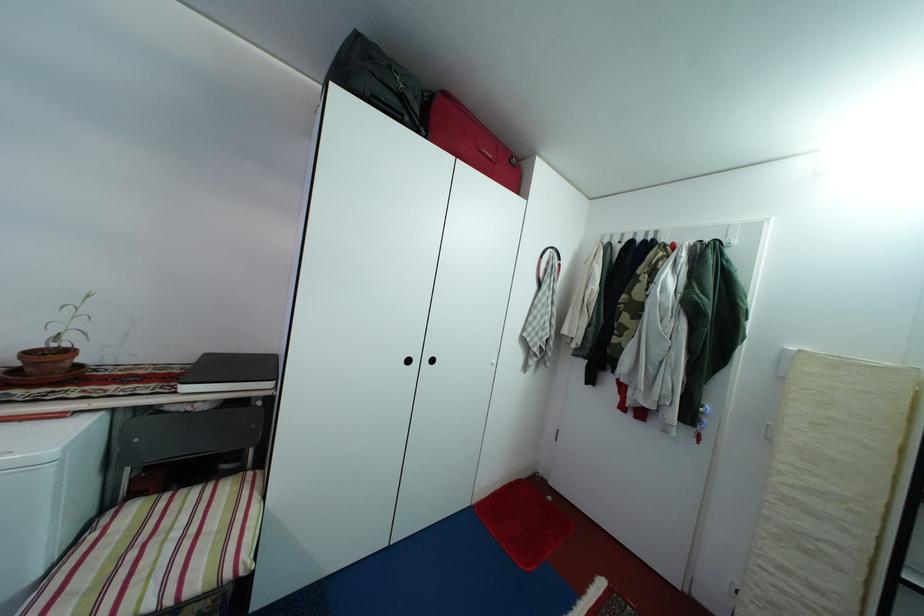
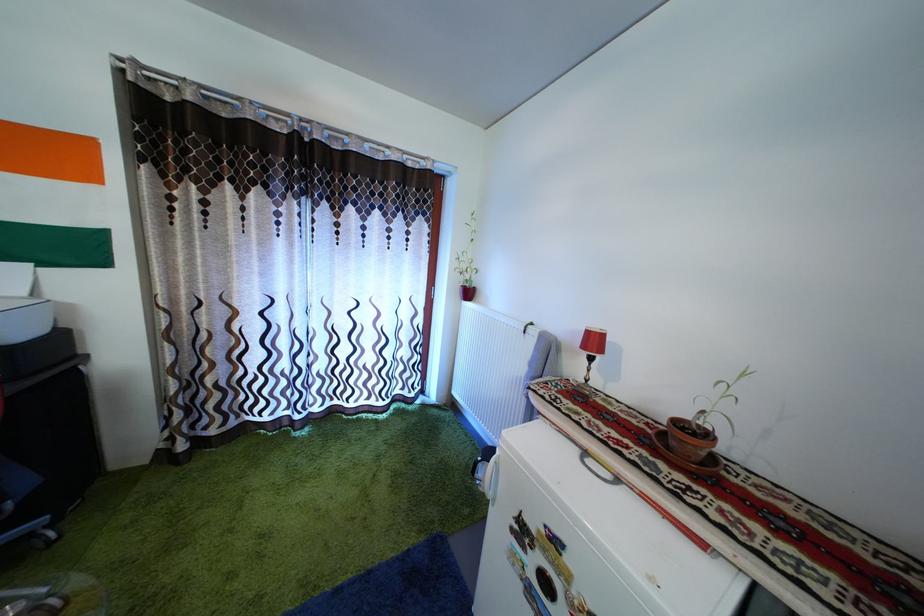
The point at (78,359) is marked in the first image. Where is the corresponding point in the second image?

(715, 442)